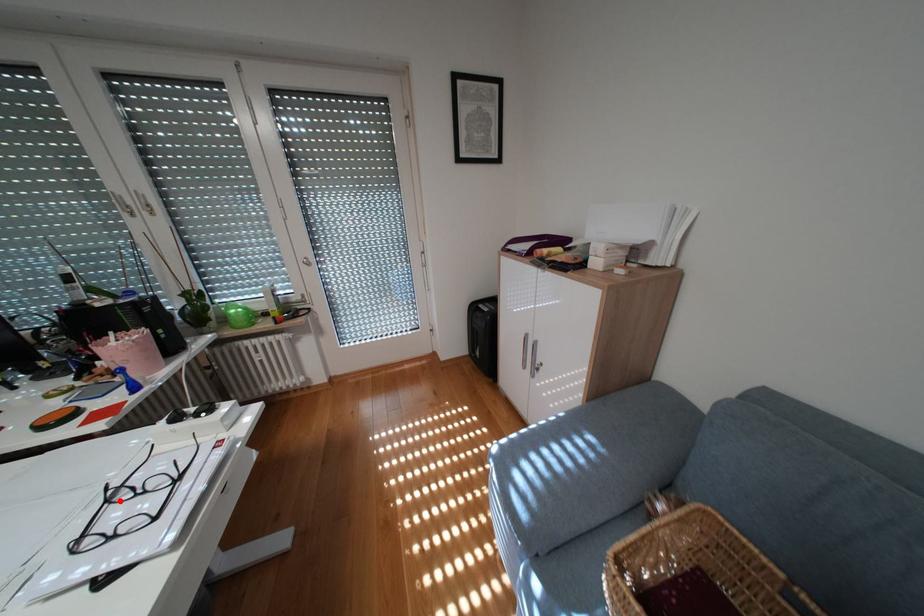
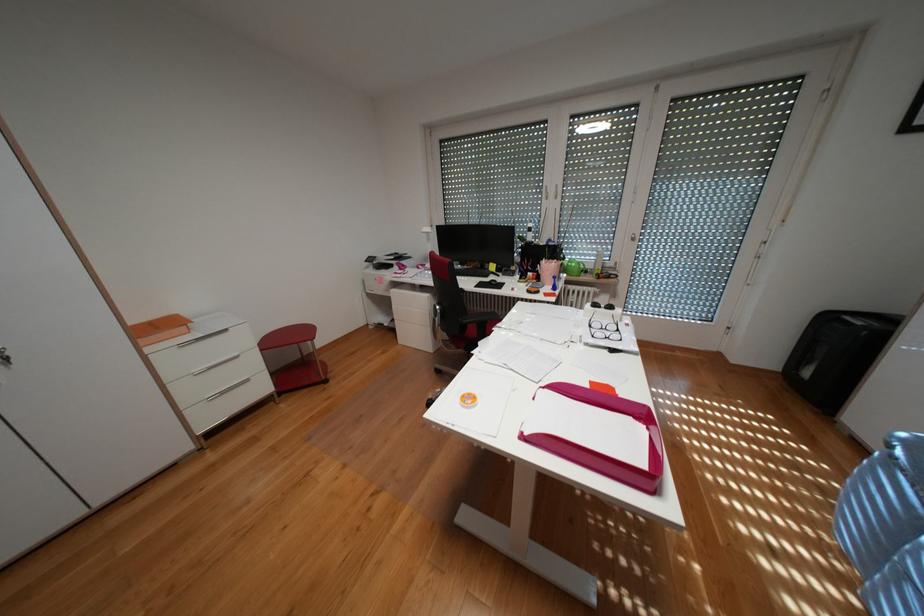
Where in the second image is the point corresponding to the highlighted location from the first image?

(602, 325)